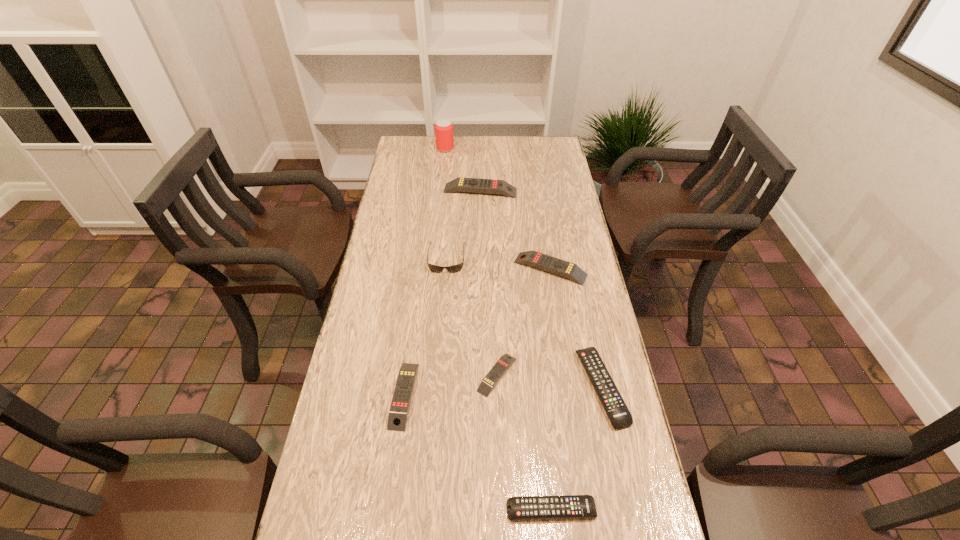
Where is `vacant area situated on the back of the nearer black remote control`? vacant area situated on the back of the nearer black remote control is located at coordinates (536, 361).

I want to click on free spot located 0.090m on the front of the smallest yellow remote control, so click(499, 431).

The image size is (960, 540). What are the coordinates of `object that is at the far edge` in the screenshot? It's located at (444, 136).

This screenshot has height=540, width=960. What are the coordinates of `object that is at the left edge` in the screenshot? It's located at (397, 419).

Find the location of a particular element. vacant space at the far edge of the desktop is located at coordinates (468, 138).

This screenshot has width=960, height=540. I want to click on free space at the left edge of the desktop, so click(x=417, y=229).

Locate an element on the screen. vacant area at the right edge of the desktop is located at coordinates (539, 200).

The height and width of the screenshot is (540, 960). In the image, there is a desktop. Identify the location of free region at the far left corner. click(417, 153).

The height and width of the screenshot is (540, 960). I want to click on vacant space at the far right corner, so click(x=553, y=151).

You are a GUI agent. You are given a task and a screenshot of the screen. Output one action in this format:
    pyautogui.click(x=<x>, y=<y>)
    Task: Click on the free area in between the smallest yellow remote control and the farther black remote control
    
    Given the screenshot: What is the action you would take?
    pyautogui.click(x=549, y=381)